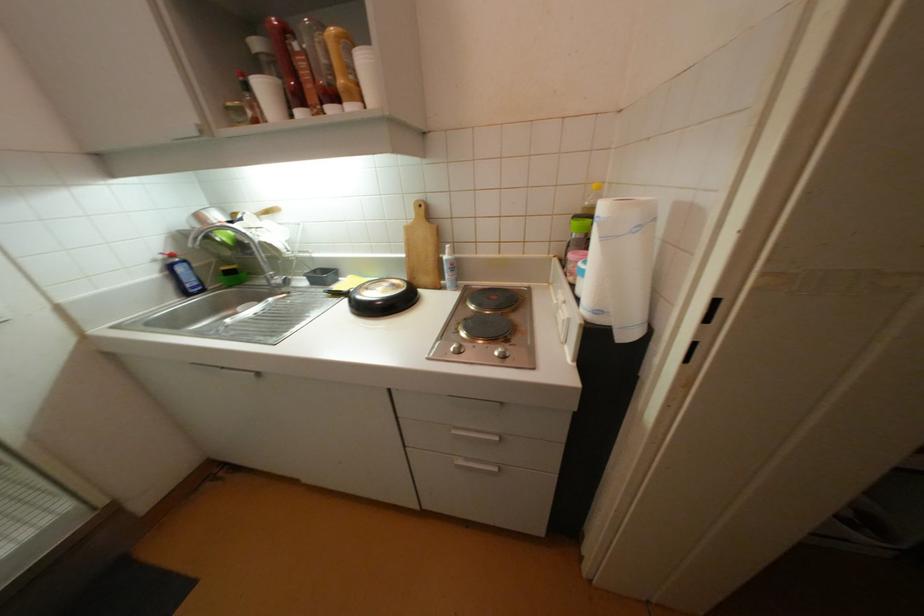
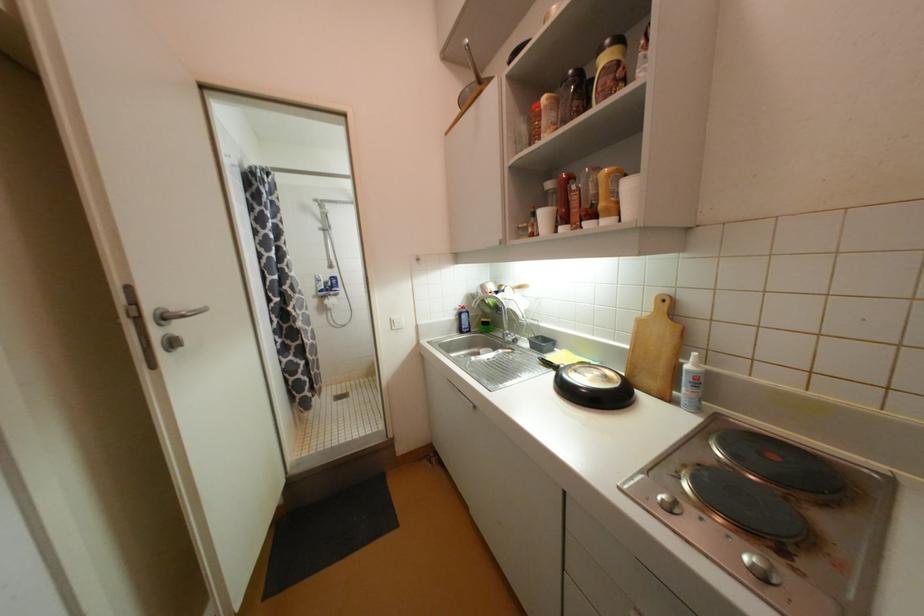
Where in the second image is the point corresponding to pixel 342 294 from the first image?

(553, 365)